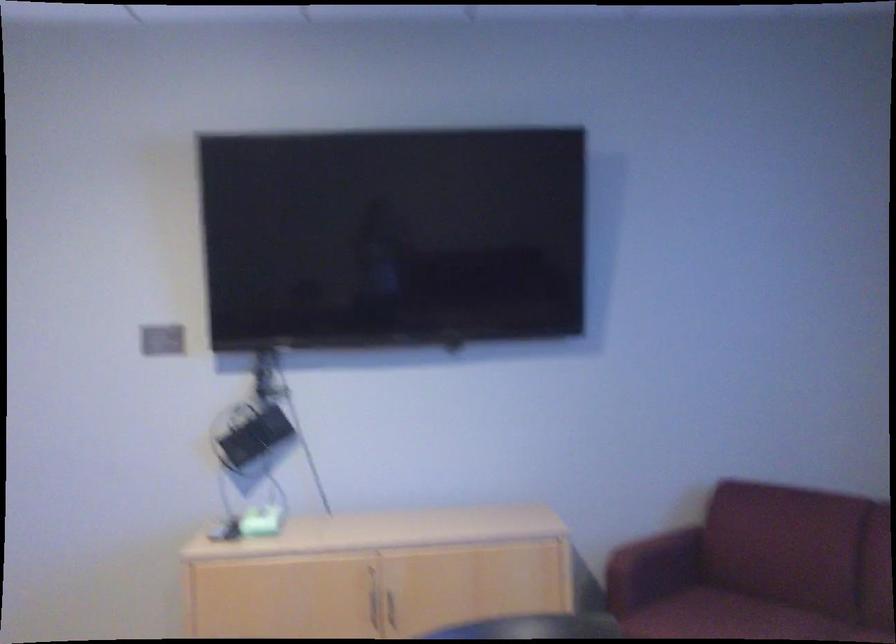
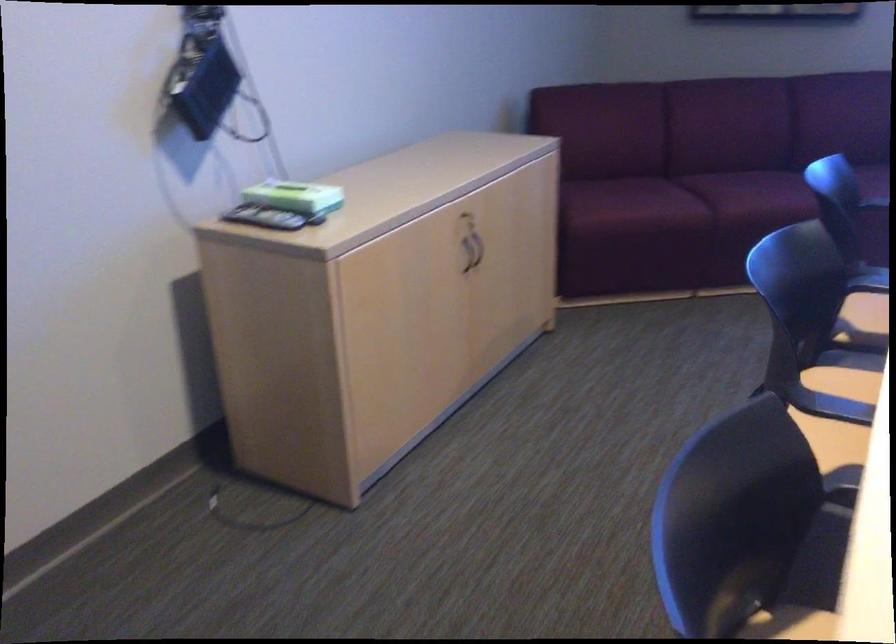
The point at (216, 527) is marked in the first image. Where is the corresponding point in the second image?

(263, 218)